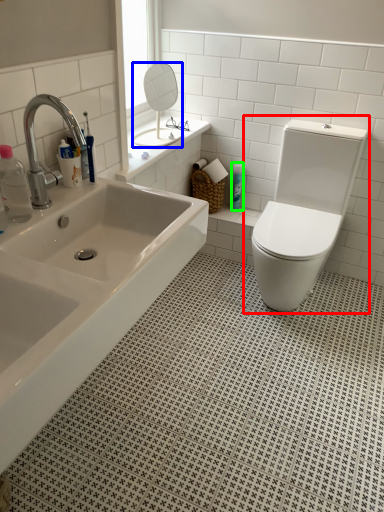
Question: Based on their relative distances, which object is farther from toilet (highlighted by a red box)? Choose from mirror (highlighted by a blue box) and toiletry (highlighted by a green box).

Choices:
 (A) mirror
 (B) toiletry

Answer: (A)